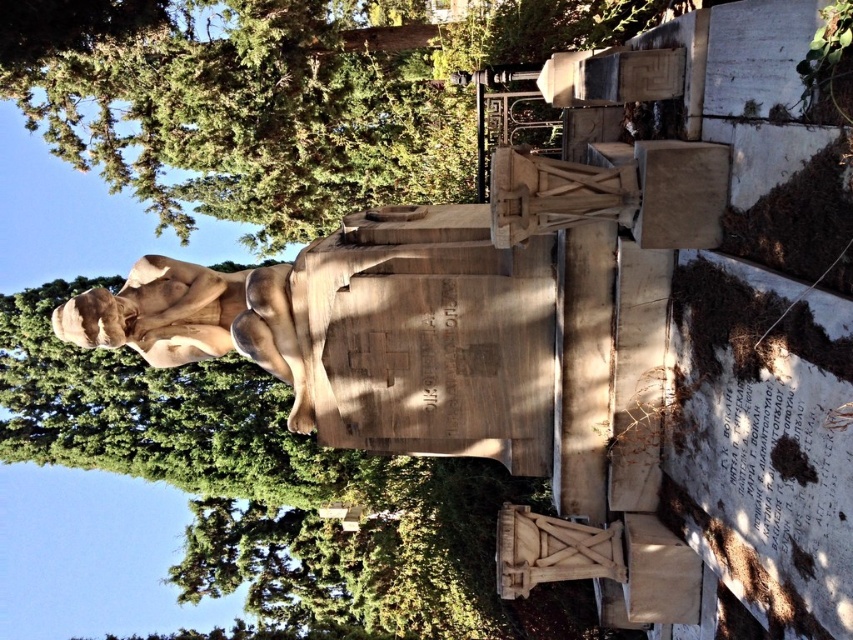
You are an artist planning to sketch this scene. You want to ensure the proportions between the green leafy tree at upper left and the matte stone statue at center are accurate. Which object should you draw first to maintain proper scale, and why?

You should draw the matte stone statue at center first because the green leafy tree at upper left is narrower than it. Since the statue is wider, starting with it allows you to establish the larger scale before adding the smaller tree.

You are an art student standing in front of the matte stone statue at center and the green leafy tree at upper left. You want to take a photo of the statue without any obstructions. Which object should you move out of the way?

The matte stone statue at center is behind the green leafy tree at upper left, so you should move the green leafy tree at upper left out of the way to get an unobstructed view of the statue.